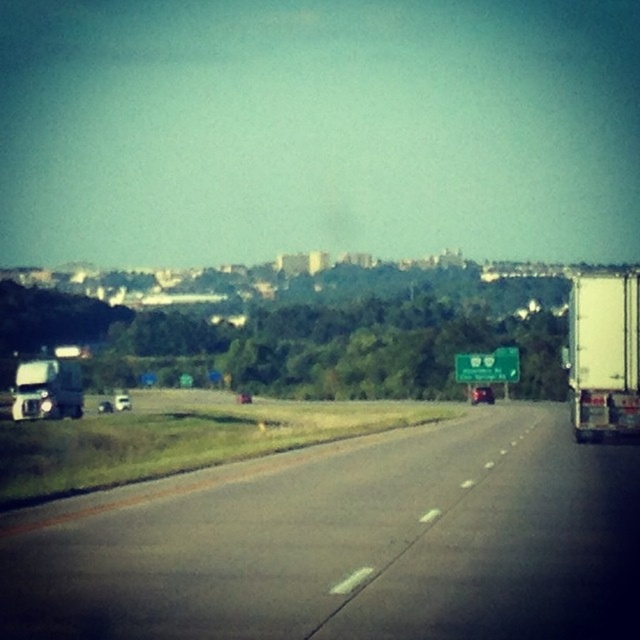
Question: Is black asphalt highway at center further to the viewer compared to white matte trailer truck at right?

Choices:
 (A) no
 (B) yes

Answer: (A)

Question: Which is farther from the white matte trailer truck at right?

Choices:
 (A) white matte truck at left
 (B) black asphalt highway at center

Answer: (A)

Question: Is black asphalt highway at center closer to camera compared to white matte trailer truck at right?

Choices:
 (A) no
 (B) yes

Answer: (B)

Question: In this image, where is black asphalt highway at center located relative to white matte truck at left?

Choices:
 (A) left
 (B) right

Answer: (B)

Question: Which point appears farthest from the camera in this image?

Choices:
 (A) (524, 593)
 (B) (49, 371)

Answer: (B)

Question: Among these objects, which one is nearest to the camera?

Choices:
 (A) black asphalt highway at center
 (B) white matte trailer truck at right
 (C) white matte truck at left

Answer: (A)